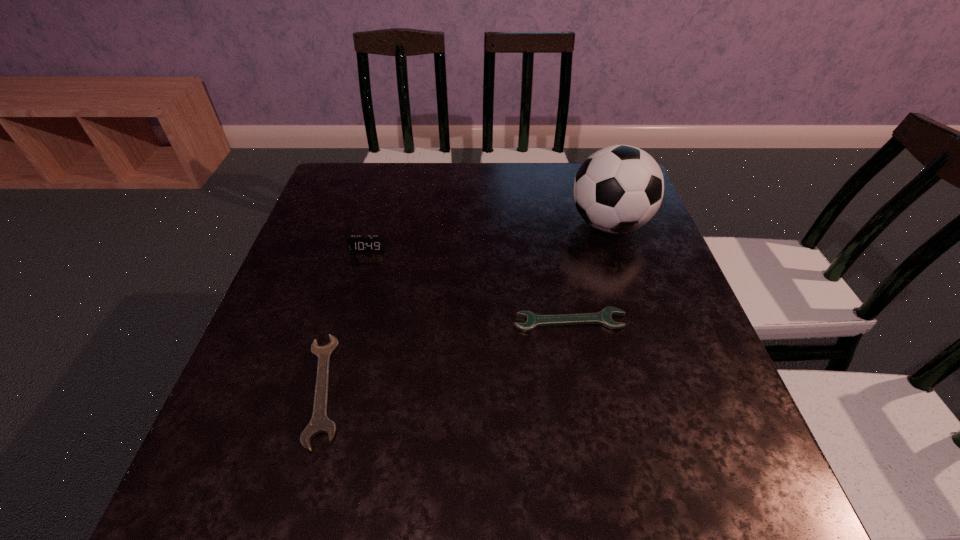
Locate an element on the screen. Image resolution: width=960 pixels, height=540 pixels. object that is at the far edge is located at coordinates (618, 189).

This screenshot has height=540, width=960. Find the location of `alarm clock present at the left edge`. alarm clock present at the left edge is located at coordinates (356, 243).

At what (x,y) coordinates should I click in order to perform the action: click on wrench situated at the left edge. Please return your answer as a coordinate pair (x, y). Looking at the image, I should click on 320,423.

What are the coordinates of `soccer ball that is at the right edge` in the screenshot? It's located at point(618,189).

At what (x,y) coordinates should I click in order to perform the action: click on wrench present at the right edge. Please return your answer as a coordinate pair (x, y). Looking at the image, I should click on (604, 318).

Where is `object that is at the far right corner`? This screenshot has width=960, height=540. object that is at the far right corner is located at coordinates tap(618, 189).

This screenshot has width=960, height=540. In the image, there is a desktop. Find the location of `free space at the far edge`. free space at the far edge is located at coordinates (566, 205).

In the image, there is a desktop. Identify the location of vacant space at the left edge. (369, 215).

I want to click on vacant area at the right edge, so click(656, 391).

Image resolution: width=960 pixels, height=540 pixels. I want to click on vacant space at the far left corner of the desktop, so click(x=350, y=163).